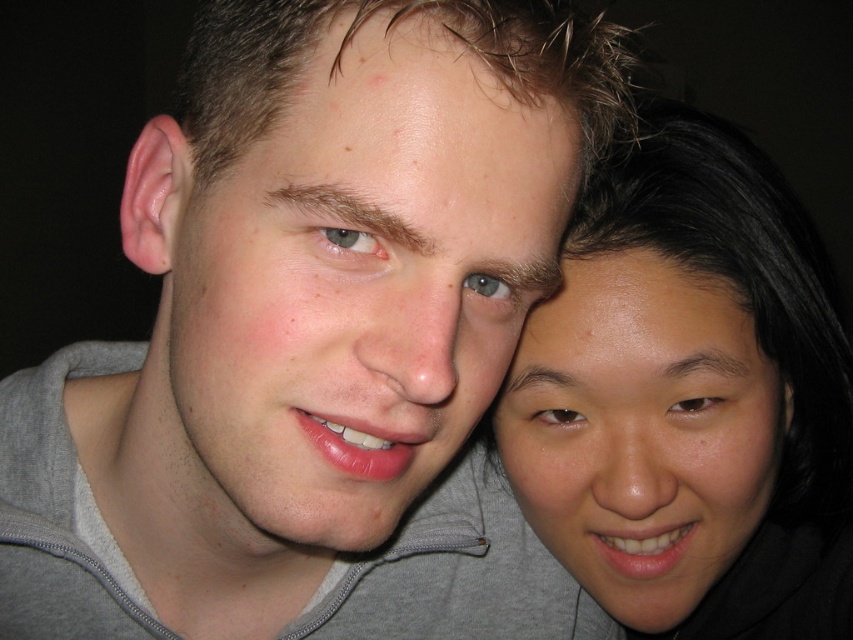
The width and height of the screenshot is (853, 640). What do you see at coordinates (642, 432) in the screenshot?
I see `smooth skin face at right` at bounding box center [642, 432].

Is point (734, 528) positioned before point (485, 528)?

Yes, it is.

This screenshot has width=853, height=640. In order to click on smooth skin face at right in this screenshot , I will do `click(642, 432)`.

This screenshot has width=853, height=640. I want to click on smooth skin face at right, so click(x=642, y=432).

Can you confirm if matte gray hoodie at center is positioned below gray hoodie at center?

Actually, matte gray hoodie at center is above gray hoodie at center.

At what (x,y) coordinates should I click in order to perform the action: click on matte gray hoodie at center. Please return your answer as a coordinate pair (x, y). The height and width of the screenshot is (640, 853). Looking at the image, I should click on (358, 285).

Which is in front, point (354, 429) or point (71, 602)?

Point (354, 429)

This screenshot has width=853, height=640. I want to click on matte gray hoodie at center, so click(358, 285).

Between point (221, 540) and point (645, 467), which one is positioned behind?

The point (221, 540) is behind.

Locate an element on the screen. matte gray hoodie at center is located at coordinates (358, 285).

At what (x,y) coordinates should I click in order to perform the action: click on matte gray hoodie at center. Please return your answer as a coordinate pair (x, y). The image size is (853, 640). Looking at the image, I should click on (358, 285).